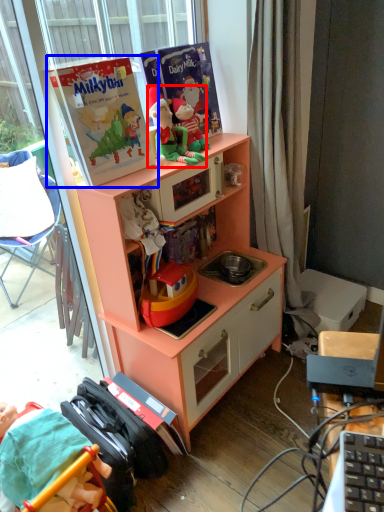
Question: Which of the following is the closest to the observer, person (highlighted by a red box) or paperback book (highlighted by a blue box)?

Choices:
 (A) person
 (B) paperback book

Answer: (B)